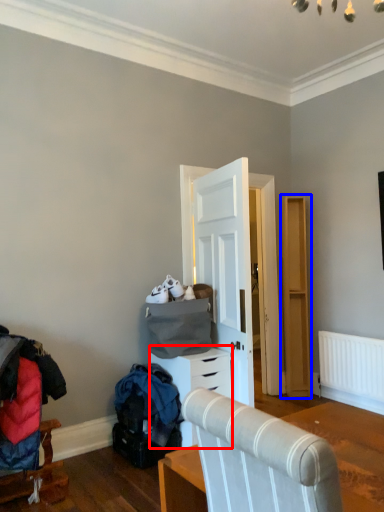
Question: Which of the following is the closest to the observer, chest of drawers (highlighted by a red box) or dresser (highlighted by a blue box)?

Choices:
 (A) chest of drawers
 (B) dresser

Answer: (A)